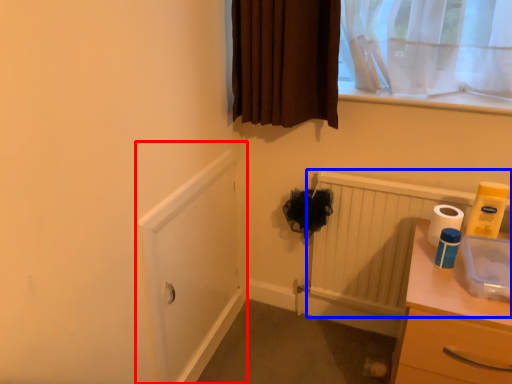
Question: Among these objects, which one is farthest to the camera, screen door (highlighted by a red box) or radiator (highlighted by a blue box)?

Choices:
 (A) screen door
 (B) radiator

Answer: (B)